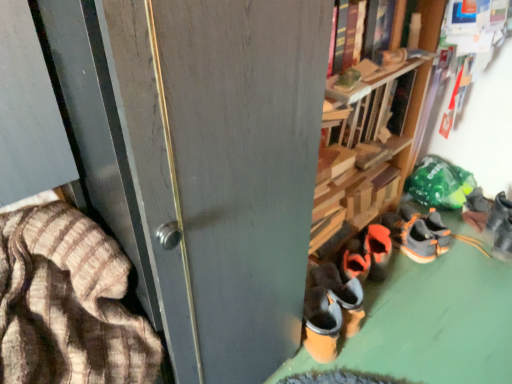
Question: Considering the positions of dark brown suede shoes at lower right, which ranks as the 5th footwear in right-to-left order, and orange suede sneaker at lower right, which is the second footwear from right to left, in the image, is dark brown suede shoes at lower right, which ranks as the 5th footwear in right-to-left order, wider or thinner than orange suede sneaker at lower right, which is the second footwear from right to left,?

Choices:
 (A) thin
 (B) wide

Answer: (B)

Question: In the image, is dark brown suede shoes at lower right, which ranks as the 5th footwear in right-to-left order, positioned in front of or behind orange suede sneaker at lower right, which is counted as the fourth footwear, starting from the left?

Choices:
 (A) behind
 (B) front

Answer: (B)

Question: Estimate the real-world distances between objects in this image. Which object is farther from the orange suede shoes at center, which is counted as the third footwear, starting from the left?

Choices:
 (A) gray suede sneakers at lower right, the 5th footwear when ordered from left to right
 (B) dark brown suede shoes at lower right, which ranks as the 5th footwear in right-to-left order
 (C) matte gray screen door at center
 (D) hardcover book at upper center
 (E) brown striped fabric at left

Answer: (E)

Question: Which object is the closest to the gray suede sneakers at lower right, which appears as the first footwear when viewed from the right?

Choices:
 (A) dark brown suede shoes at lower right, which is the first footwear in left-to-right order
 (B) orange suede shoes at center, the 3th footwear from the right
 (C) orange suede sneaker at lower right, which is the second footwear from right to left
 (D) brown striped fabric at left
 (E) hardcover book at upper center

Answer: (C)